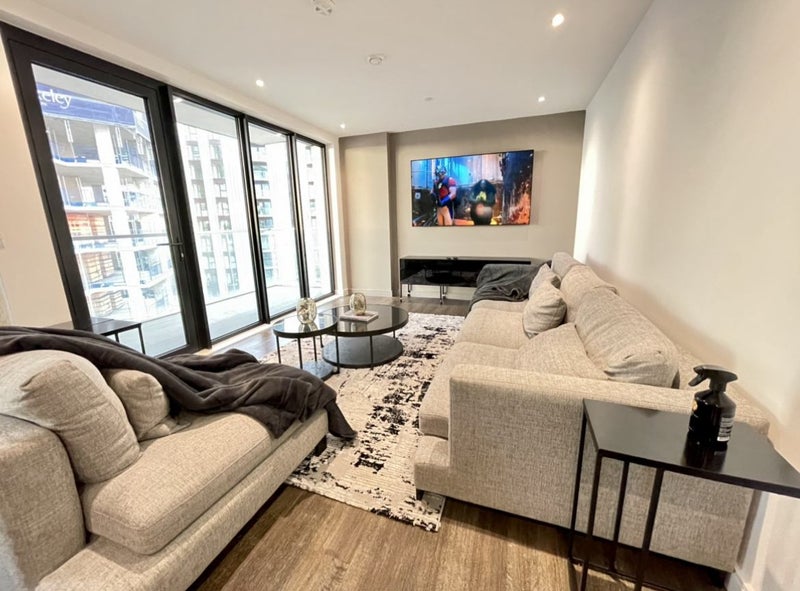
At what (x,y) coordinates should I click in order to perform the action: click on couch. Please return your answer as a coordinate pair (x, y). Image resolution: width=800 pixels, height=591 pixels. Looking at the image, I should click on (186, 470).